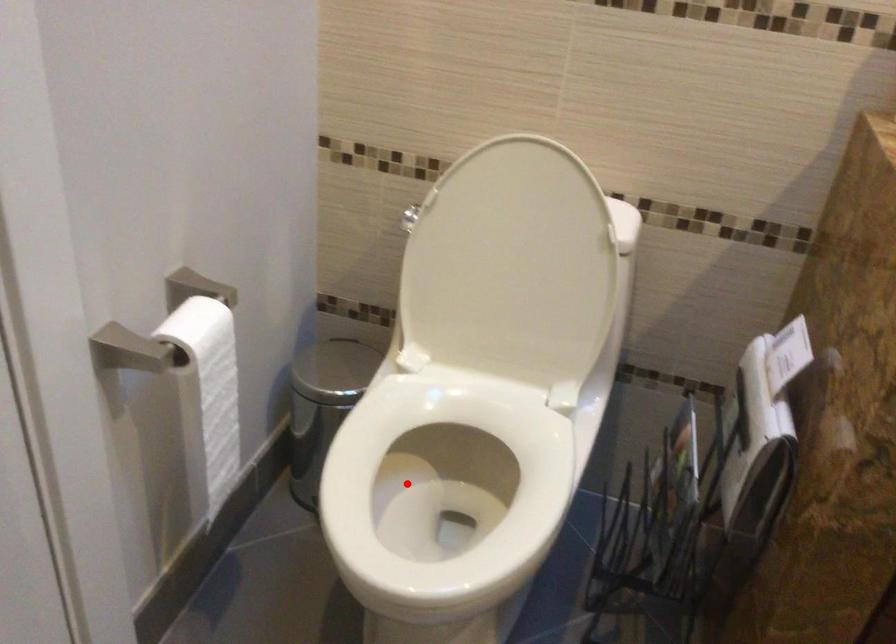
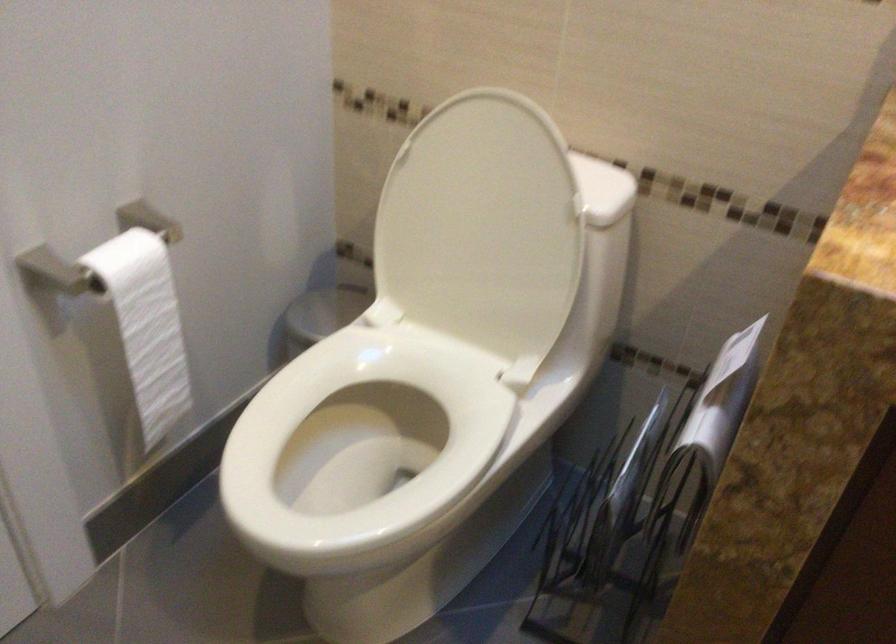
Locate, in the second image, the point that corresponds to the highlighted location in the first image.

(363, 438)